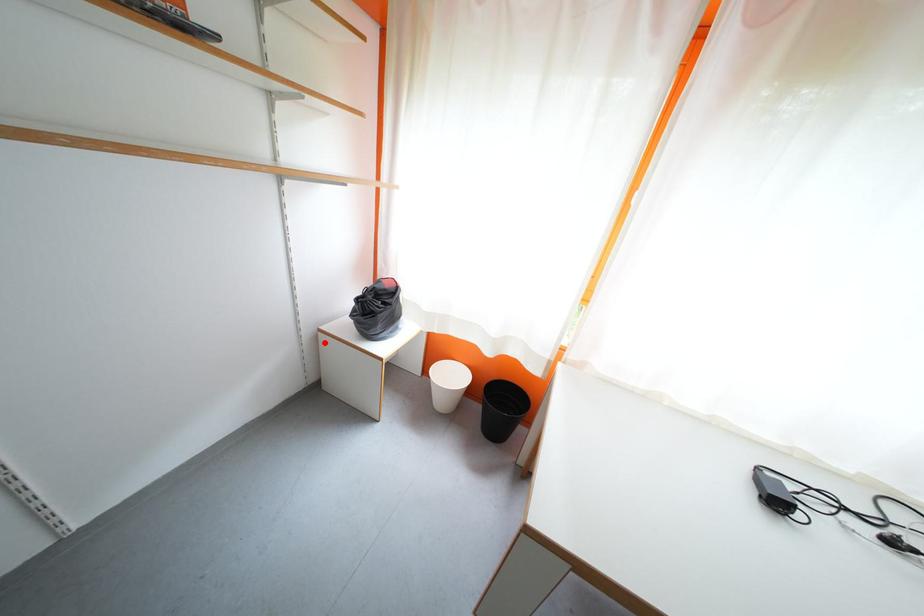
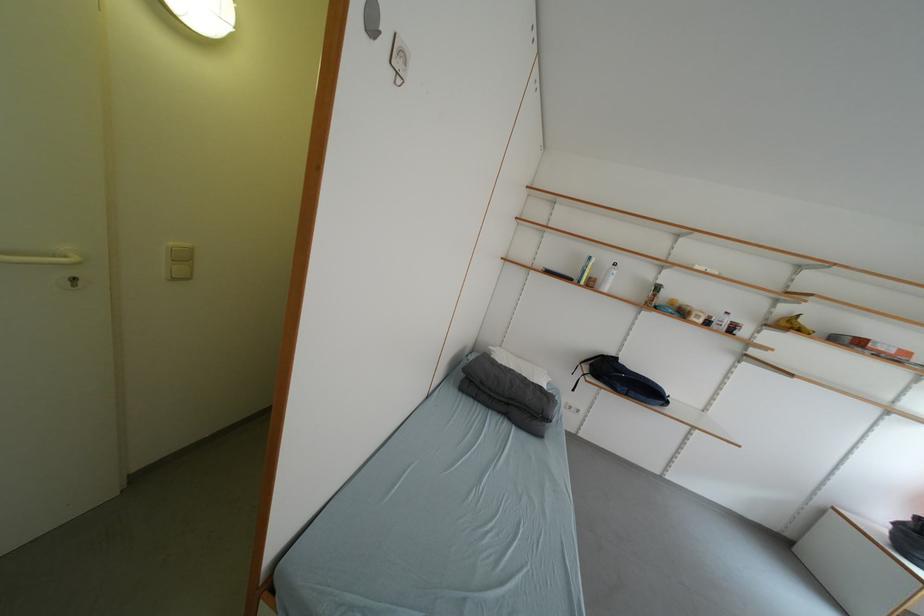
Question: I am providing you with two images of the same scene from different viewpoints. A red point is marked on the first image. Can you still see the location of the red point in image 2?

Choices:
 (A) Yes
 (B) No

Answer: (A)